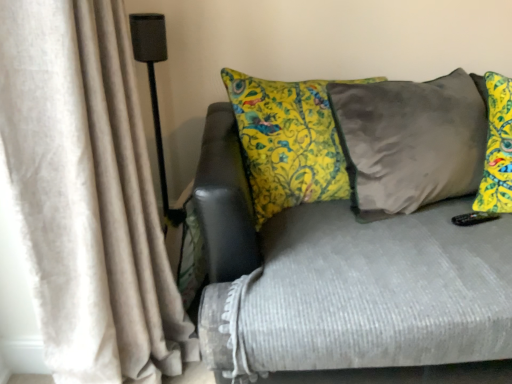
Question: Does textured gray couch at center have a lesser width compared to beige velvet curtain at left?

Choices:
 (A) no
 (B) yes

Answer: (A)

Question: Considering the relative sizes of textured gray couch at center and beige velvet curtain at left in the image provided, is textured gray couch at center wider than beige velvet curtain at left?

Choices:
 (A) no
 (B) yes

Answer: (B)

Question: Is textured gray couch at center further to camera compared to beige velvet curtain at left?

Choices:
 (A) yes
 (B) no

Answer: (A)

Question: From a real-world perspective, is textured gray couch at center located higher than beige velvet curtain at left?

Choices:
 (A) no
 (B) yes

Answer: (A)

Question: Considering the relative sizes of textured gray couch at center and beige velvet curtain at left in the image provided, is textured gray couch at center smaller than beige velvet curtain at left?

Choices:
 (A) no
 (B) yes

Answer: (A)

Question: In the image, is textured gray couch at center positioned in front of or behind black matte speaker at left?

Choices:
 (A) behind
 (B) front

Answer: (B)

Question: From a real-world perspective, is textured gray couch at center positioned above or below black matte speaker at left?

Choices:
 (A) above
 (B) below

Answer: (B)

Question: Is textured gray couch at center taller or shorter than black matte speaker at left?

Choices:
 (A) tall
 (B) short

Answer: (B)

Question: Is textured gray couch at center to the left or to the right of black matte speaker at left in the image?

Choices:
 (A) left
 (B) right

Answer: (B)

Question: Would you say black matte speaker at left is to the left or to the right of beige velvet curtain at left in the picture?

Choices:
 (A) right
 (B) left

Answer: (B)

Question: Is point (146, 16) positioned closer to the camera than point (67, 233)?

Choices:
 (A) farther
 (B) closer

Answer: (A)

Question: In terms of height, does black matte speaker at left look taller or shorter compared to beige velvet curtain at left?

Choices:
 (A) short
 (B) tall

Answer: (A)

Question: In terms of size, does black matte speaker at left appear bigger or smaller than beige velvet curtain at left?

Choices:
 (A) small
 (B) big

Answer: (A)

Question: Is textured gray couch at center taller or shorter than beige velvet curtain at left?

Choices:
 (A) tall
 (B) short

Answer: (B)

Question: Do you think textured gray couch at center is within beige velvet curtain at left, or outside of it?

Choices:
 (A) outside
 (B) inside

Answer: (A)